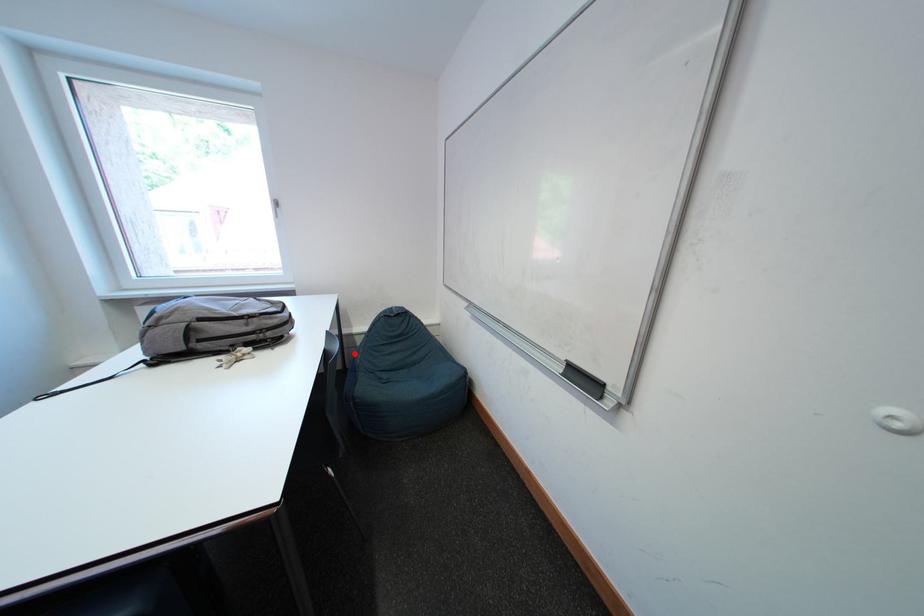
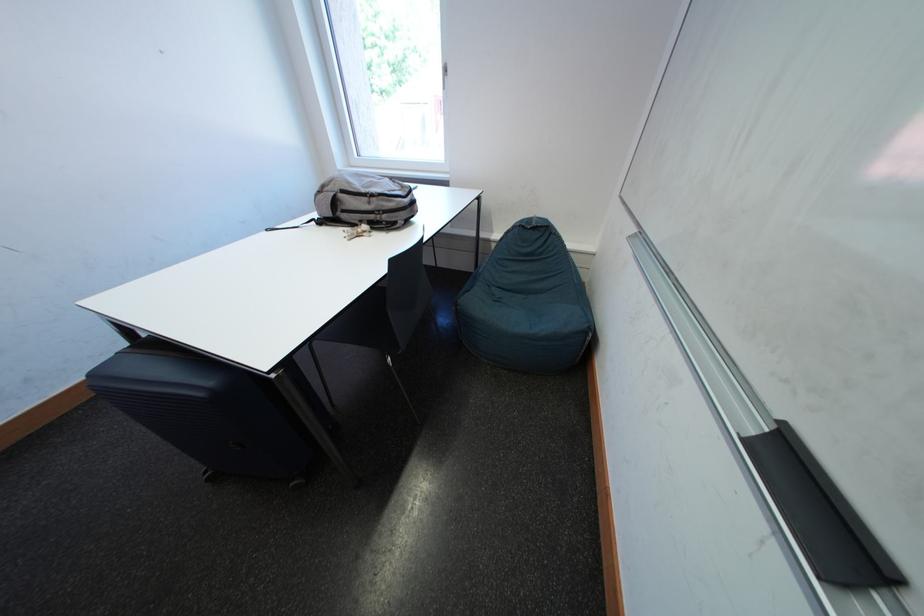
The point at the highlighted location is marked in the first image. Where is the corresponding point in the second image?

(490, 259)